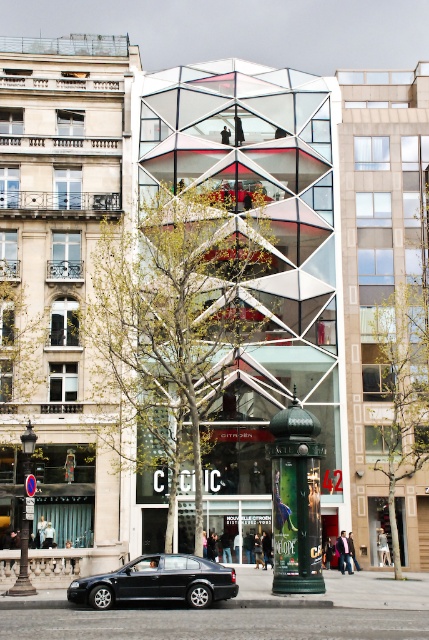
Between green leafy tree at center and shiny black sedan at lower left, which one appears on the right side from the viewer's perspective?

From the viewer's perspective, green leafy tree at center appears more on the right side.

Which is in front, point (139, 225) or point (120, 582)?

Point (120, 582) is more forward.

The image size is (429, 640). Find the location of `green leafy tree at center`. green leafy tree at center is located at coordinates (177, 316).

Who is positioned more to the left, green leafy tree at center or green metallic pillar at center?

Positioned to the left is green leafy tree at center.

Does green leafy tree at center have a lesser width compared to green metallic pillar at center?

In fact, green leafy tree at center might be wider than green metallic pillar at center.

This screenshot has width=429, height=640. Find the location of `green leafy tree at center`. green leafy tree at center is located at coordinates (177, 316).

Is green leafy tree at right behind shiny black sedan at lower left?

Yes, green leafy tree at right is behind shiny black sedan at lower left.

Between point (425, 193) and point (144, 566), which one is positioned behind?

Point (425, 193)

Image resolution: width=429 pixels, height=640 pixels. In order to click on green leafy tree at right in this screenshot , I will do `click(404, 372)`.